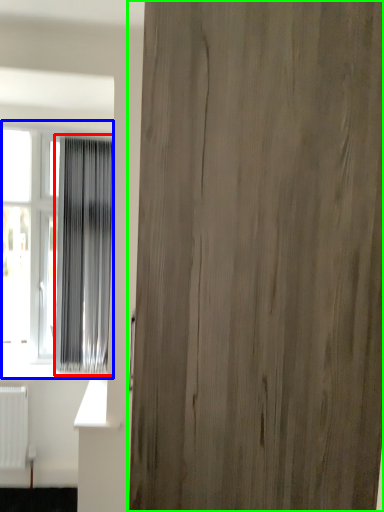
Question: Considering the real-world distances, which object is farthest from curtain (highlighted by a red box)? window (highlighted by a blue box) or door (highlighted by a green box)?

Choices:
 (A) window
 (B) door

Answer: (B)